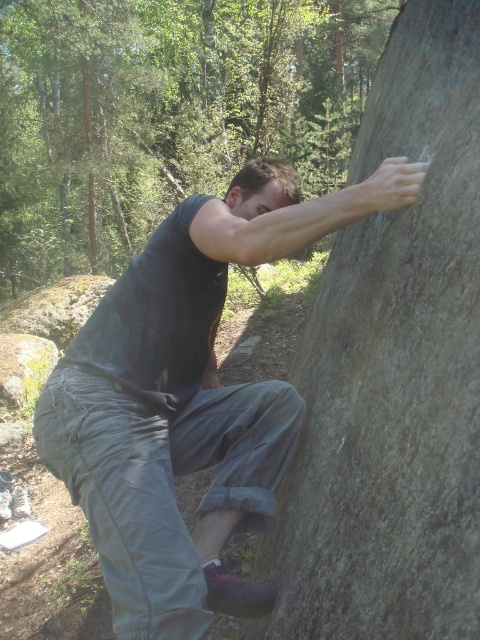
Describe the element at coordinates (393, 372) in the screenshot. I see `smooth gray rock at center` at that location.

Who is more distant from viewer, (424, 616) or (109, 460)?

Point (109, 460)

Locate an element on the screen. smooth gray rock at center is located at coordinates (393, 372).